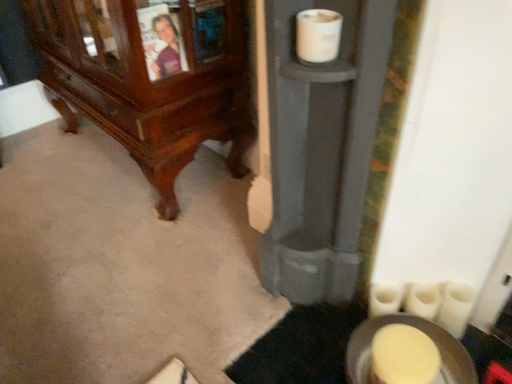
Question: Should I look upward or downward to see white matte toilet paper at lower right, the second toilet paper from the right?

Choices:
 (A) down
 (B) up

Answer: (A)

Question: Is white matte toilet paper at upper center, which is the third toilet paper in right-to-left order, at the back of white matte toilet paper at lower right, the 1th toilet paper from the back?

Choices:
 (A) no
 (B) yes

Answer: (A)

Question: Is white matte toilet paper at lower right, which is counted as the 2th toilet paper, starting from the top, thinner than white matte toilet paper at upper center, which is the third toilet paper in right-to-left order?

Choices:
 (A) no
 (B) yes

Answer: (B)

Question: Is white matte toilet paper at lower right, which is counted as the 2th toilet paper, starting from the top, far from white matte toilet paper at upper center, the 1th toilet paper viewed from the left?

Choices:
 (A) no
 (B) yes

Answer: (A)

Question: Is white matte toilet paper at lower right, the 1th toilet paper from the back, shorter than white matte toilet paper at upper center, which ranks as the 1th toilet paper in top-to-bottom order?

Choices:
 (A) yes
 (B) no

Answer: (B)

Question: Considering the relative sizes of white matte toilet paper at lower right, the 1th toilet paper from the back, and white matte toilet paper at upper center, the 1th toilet paper viewed from the left, in the image provided, is white matte toilet paper at lower right, the 1th toilet paper from the back, smaller than white matte toilet paper at upper center, the 1th toilet paper viewed from the left,?

Choices:
 (A) yes
 (B) no

Answer: (A)

Question: Considering the relative sizes of white matte toilet paper at lower right, acting as the 3th toilet paper starting from the front, and white matte toilet paper at upper center, acting as the 3th toilet paper starting from the back, in the image provided, is white matte toilet paper at lower right, acting as the 3th toilet paper starting from the front, wider than white matte toilet paper at upper center, acting as the 3th toilet paper starting from the back,?

Choices:
 (A) no
 (B) yes

Answer: (A)

Question: From a real-world perspective, is white matte toilet paper at lower right, the 1th toilet paper from the back, positioned under white matte toilet paper at lower right, the first toilet paper positioned from the bottom, based on gravity?

Choices:
 (A) no
 (B) yes

Answer: (B)

Question: Is white matte toilet paper at lower right, marked as the 3th toilet paper in a top-to-bottom arrangement, at the back of white matte toilet paper at lower right, the second toilet paper from the right?

Choices:
 (A) no
 (B) yes

Answer: (A)

Question: From the image's perspective, would you say white matte toilet paper at lower right, the 2th toilet paper in the left-to-right sequence, is shown under white matte toilet paper at lower right, which appears as the 1th toilet paper when viewed from the right?

Choices:
 (A) yes
 (B) no

Answer: (B)

Question: Does white matte toilet paper at lower right, the 1th toilet paper from the back, come in front of white matte toilet paper at lower right, the 3th toilet paper when ordered from left to right?

Choices:
 (A) no
 (B) yes

Answer: (A)

Question: Is white matte toilet paper at lower right, the second toilet paper from the right, next to white matte toilet paper at lower right, the second toilet paper when ordered from front to back, and touching it?

Choices:
 (A) no
 (B) yes

Answer: (A)

Question: From a real-world perspective, is white matte toilet paper at lower right, the 2th toilet paper positioned from the bottom, physically above white matte toilet paper at lower right, the second toilet paper viewed from the back?

Choices:
 (A) no
 (B) yes

Answer: (A)

Question: Can you confirm if white matte toilet paper at lower right, which appears as the 1th toilet paper when viewed from the right, is bigger than white matte toilet paper at lower right, the 2th toilet paper in the left-to-right sequence?

Choices:
 (A) no
 (B) yes

Answer: (B)